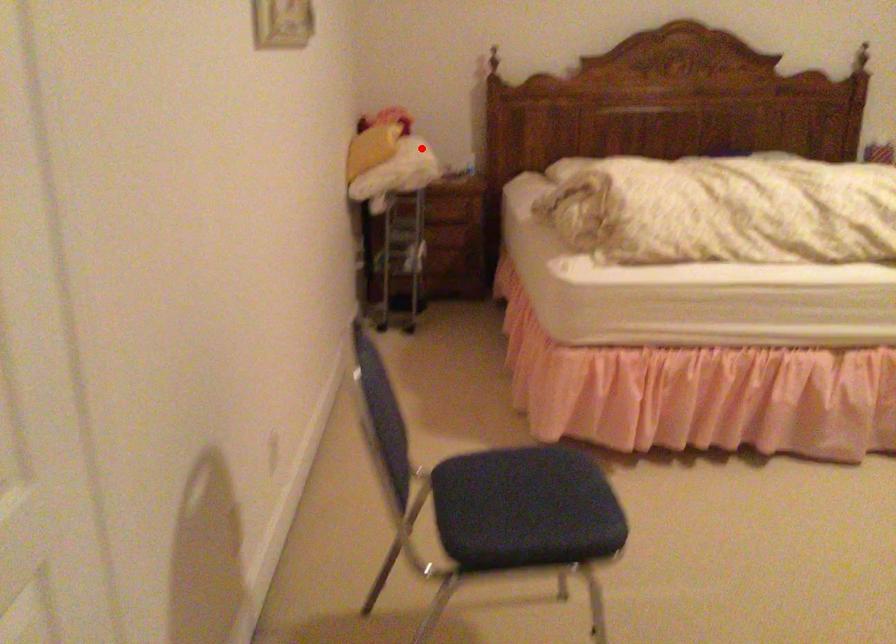
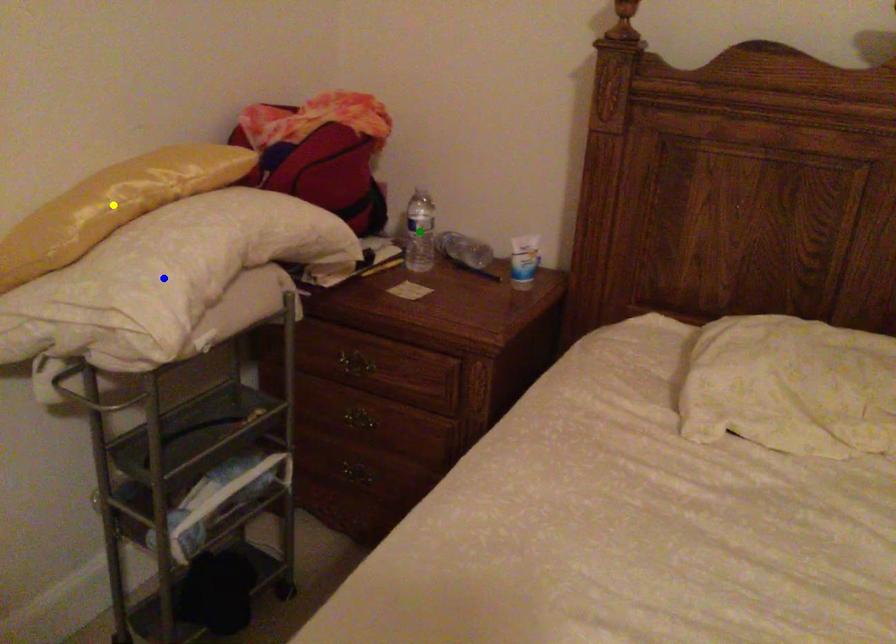
Question: I am providing you with two images of the same scene from different viewpoints. A red point is marked on the first image. You are given multiple points on the second image. Which point in image 2 represents the same 3d spot as the red point in image 1?

Choices:
 (A) blue point
 (B) green point
 (C) yellow point

Answer: (A)